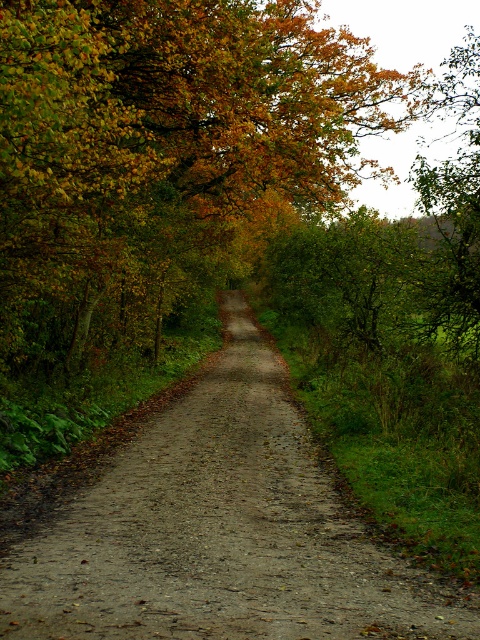
Is yellow-green leaves at center bigger than dull brown gravel at center?

Yes.

Describe the element at coordinates (163, 156) in the screenshot. I see `yellow-green leaves at center` at that location.

This screenshot has width=480, height=640. Identify the location of yellow-green leaves at center. (163, 156).